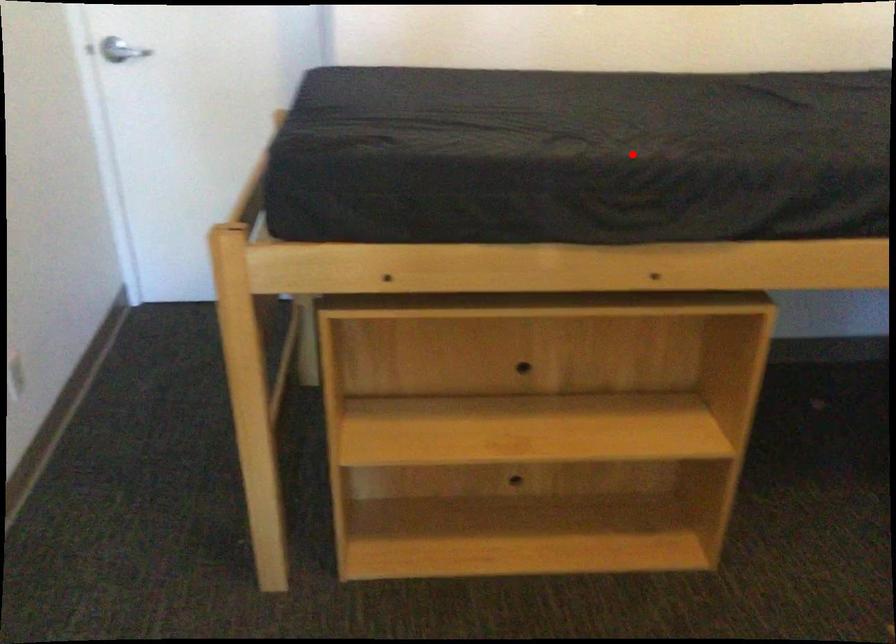
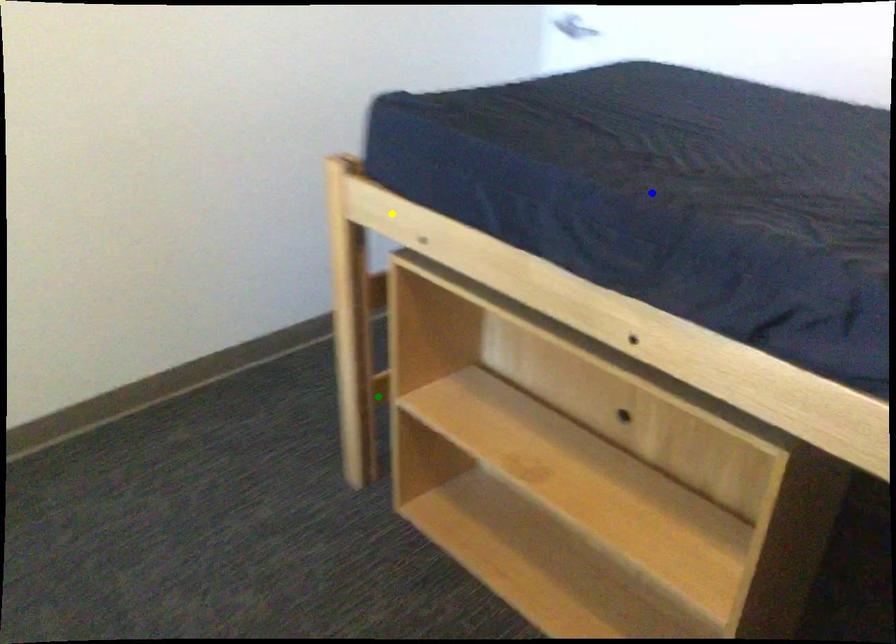
Question: I am providing you with two images of the same scene from different viewpoints. A red point is marked on the first image. You are given multiple points on the second image. Can you choose the point in image 2 that corresponds to the point in image 1?

Choices:
 (A) blue point
 (B) yellow point
 (C) green point

Answer: (A)